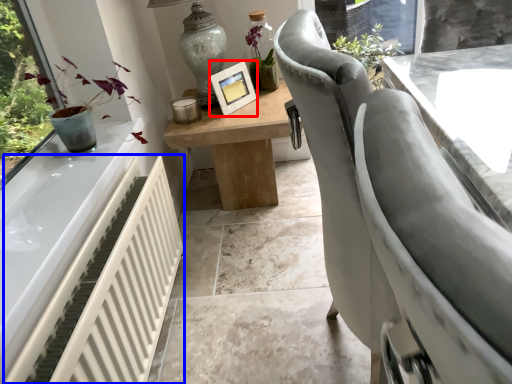
Question: Which of the following is the farthest to the observer, picture frame (highlighted by a red box) or radiator (highlighted by a blue box)?

Choices:
 (A) picture frame
 (B) radiator

Answer: (A)